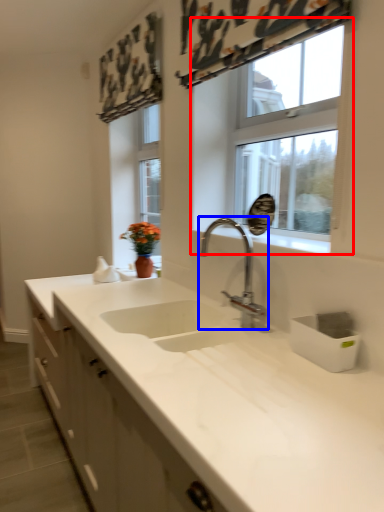
Question: Which of the following is the farthest to the observer, window (highlighted by a red box) or tap (highlighted by a blue box)?

Choices:
 (A) window
 (B) tap

Answer: (A)